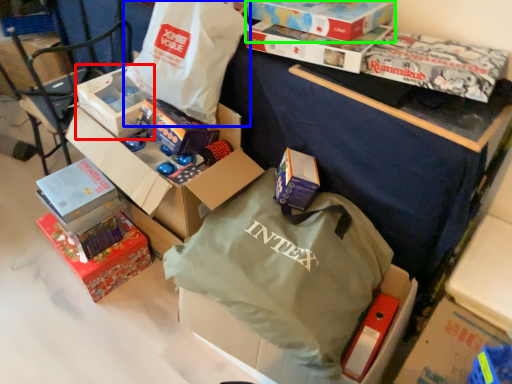
Question: Considering the real-world distances, which object is closest to box (highlighted by a red box)? bag (highlighted by a blue box) or box (highlighted by a green box).

Choices:
 (A) bag
 (B) box

Answer: (A)